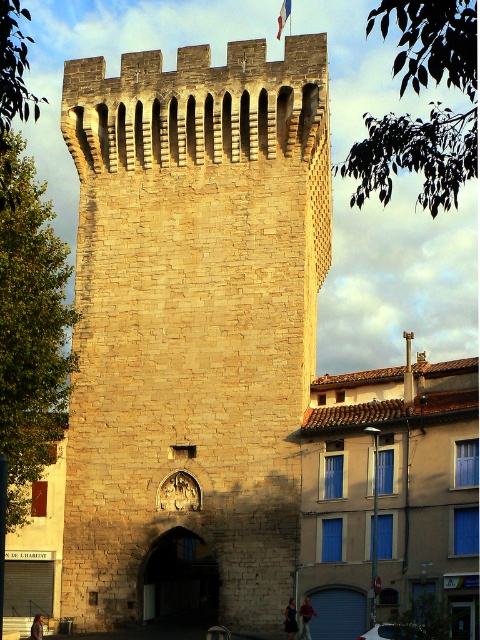
Who is more forward, (169, 532) or (345, 593)?

Positioned in front is point (345, 593).

Looking at this image, can you confirm if dark stone archway at center is positioned to the left of smooth gray door at center?

Yes, dark stone archway at center is to the left of smooth gray door at center.

Does point (180, 616) lie behind point (362, 628)?

Yes, point (180, 616) is farther from viewer.

This screenshot has height=640, width=480. Identify the location of dark stone archway at center. (180, 579).

Is the position of dark stone archway at center less distant than that of blue fabric flag at upper center?

Yes, dark stone archway at center is closer to the viewer.

Measure the distance between dark stone archway at center and camera.

dark stone archway at center and camera are 69.78 meters apart from each other.

Between point (152, 576) and point (283, 6), which one is positioned in front?

Positioned in front is point (152, 576).

The image size is (480, 640). I want to click on dark stone archway at center, so click(180, 579).

From the picture: Between stone tower at center and smooth gray door at center, which one has more height?

stone tower at center

Does stone tower at center have a lesser height compared to smooth gray door at center?

Incorrect, stone tower at center's height does not fall short of smooth gray door at center's.

Image resolution: width=480 pixels, height=640 pixels. Find the location of `stone tower at center`. stone tower at center is located at coordinates (193, 317).